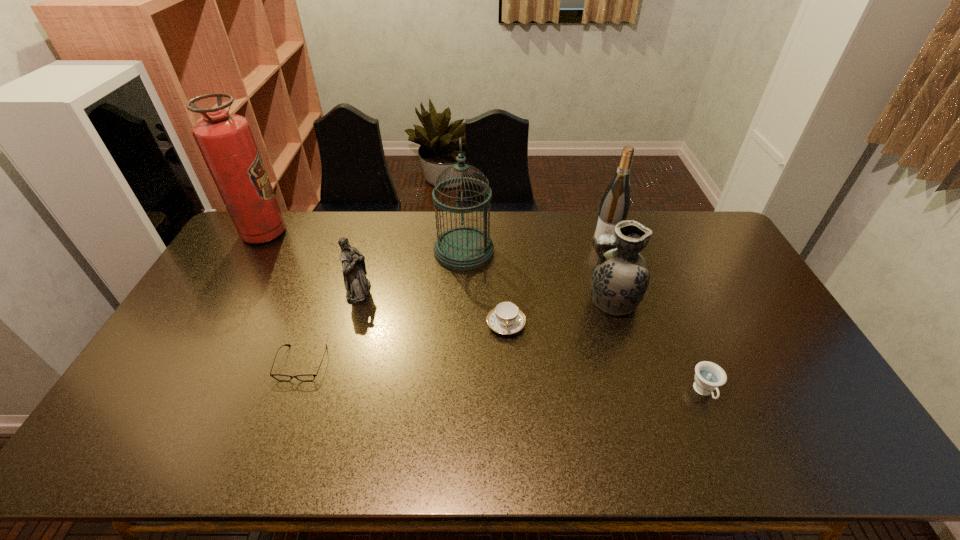
Locate an element on the screen. This screenshot has height=540, width=960. wine bottle present at the far edge is located at coordinates (615, 203).

Identify the location of object that is at the left edge. This screenshot has width=960, height=540. (226, 142).

You are a GUI agent. You are given a task and a screenshot of the screen. Output one action in this format:
    pyautogui.click(x=<x>, y=<y>)
    Task: Click on the object situated at the far left corner
    The image size is (960, 540).
    Given the screenshot: What is the action you would take?
    pyautogui.click(x=226, y=142)

This screenshot has height=540, width=960. I want to click on vacant space at the far edge of the desktop, so click(524, 231).

I want to click on vacant space at the near edge of the desktop, so click(x=683, y=429).

Image resolution: width=960 pixels, height=540 pixels. In the image, there is a desktop. Find the location of `vacant region at the far right corner`. vacant region at the far right corner is located at coordinates (682, 233).

Locate an element on the screen. The height and width of the screenshot is (540, 960). empty space that is in between the spectacles and the figurine is located at coordinates (330, 327).

You are a GUI agent. You are given a task and a screenshot of the screen. Output one action in this format:
    pyautogui.click(x=<x>, y=<y>)
    Task: Click on the free space between the left teacup and the birdcage
    The height and width of the screenshot is (540, 960).
    Given the screenshot: What is the action you would take?
    pyautogui.click(x=485, y=288)

At what (x,y) coordinates should I click in order to perform the action: click on free space between the birdcage and the fire extinguisher. Please return your answer as a coordinate pair (x, y). The width and height of the screenshot is (960, 540). Looking at the image, I should click on (364, 242).

Where is `empty location between the farther teacup and the fourth shortest object`? empty location between the farther teacup and the fourth shortest object is located at coordinates (433, 308).